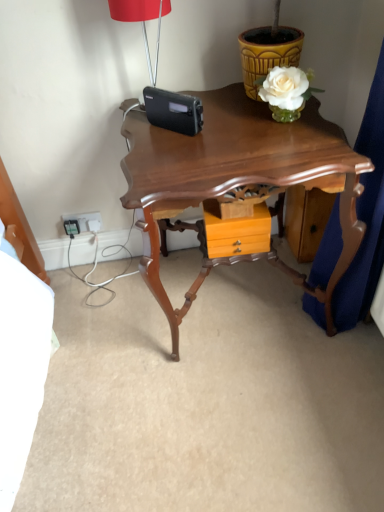
The image size is (384, 512). I want to click on vacant area to the right of matte red lampshade at upper center, so click(218, 104).